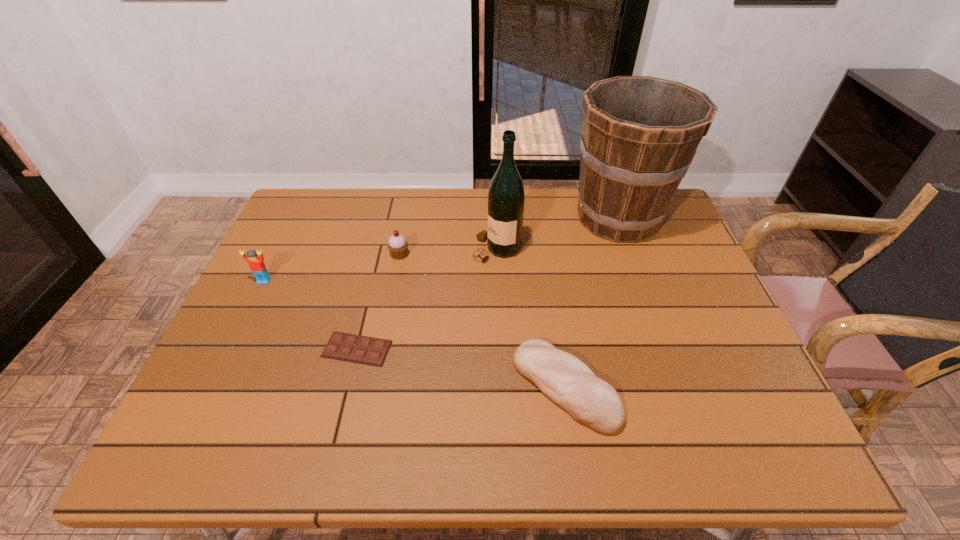
Find the location of a particular element. The width and height of the screenshot is (960, 540). vacant region that satisfies the following two spatial constraints: 1. on the front side of the shortest object; 2. on the left side of the second shortest object is located at coordinates (348, 387).

I want to click on free space that satisfies the following two spatial constraints: 1. on the face of the leftmost object; 2. on the right side of the chocolate bar, so click(x=231, y=349).